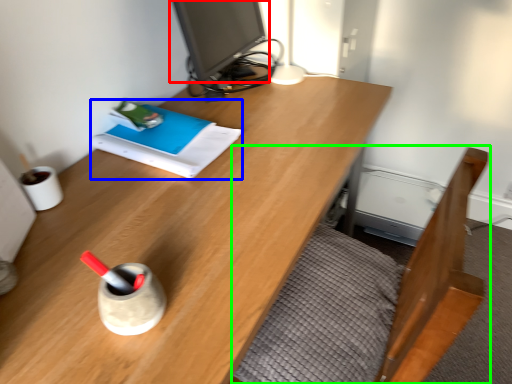
Question: Which is nearer to the computer monitor (highlighted by a red box)? book (highlighted by a blue box) or bed frame (highlighted by a green box).

Choices:
 (A) book
 (B) bed frame

Answer: (A)